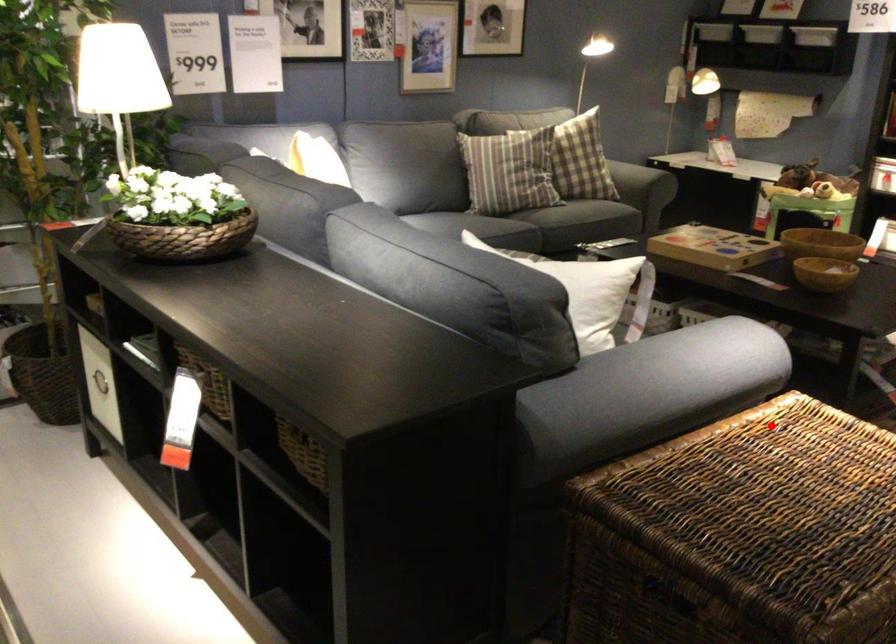
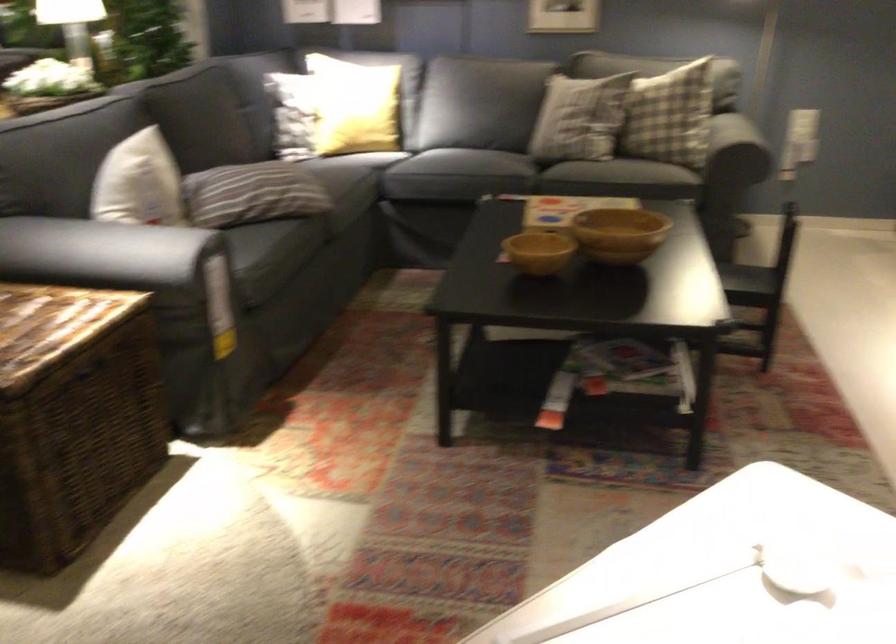
Question: I am providing you with two images of the same scene from different viewpoints. Given a red point in image1, look at the same physical point in image2. Is it:

Choices:
 (A) Closer to the viewpoint
 (B) Farther from the viewpoint

Answer: (B)